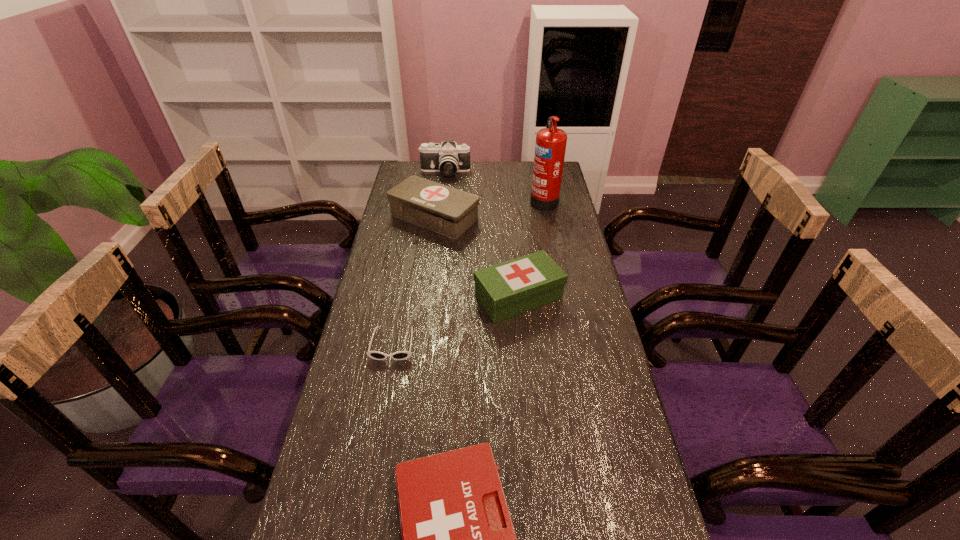
In order to click on vacant region located 0.060m on the left of the second tallest object in this screenshot , I will do point(406,172).

This screenshot has height=540, width=960. What are the coordinates of `free space located on the front of the farthest first-aid kit` in the screenshot? It's located at (424, 293).

This screenshot has height=540, width=960. Find the location of `vacant space positioned on the back of the second nearest first-aid kit`. vacant space positioned on the back of the second nearest first-aid kit is located at coordinates (515, 254).

Find the location of `free space located with the lenses of the second nearest object facing outward`. free space located with the lenses of the second nearest object facing outward is located at coordinates 364,502.

Where is `fire extinguisher that is at the far edge`? Image resolution: width=960 pixels, height=540 pixels. fire extinguisher that is at the far edge is located at coordinates (550, 146).

You are a GUI agent. You are given a task and a screenshot of the screen. Output one action in this format:
    pyautogui.click(x=<x>, y=<y>)
    Task: Click on the camera positioned at the far edge
    The width and height of the screenshot is (960, 540).
    Given the screenshot: What is the action you would take?
    pyautogui.click(x=448, y=158)

Identify the location of camera that is at the left edge. (448, 158).

In order to click on the first-aid kit that is at the left edge in this screenshot , I will do `click(451, 212)`.

Identify the location of sunglasses situated at the left edge. (400, 355).

Locate an element on the screen. This screenshot has width=960, height=540. fire extinguisher present at the right edge is located at coordinates (550, 146).